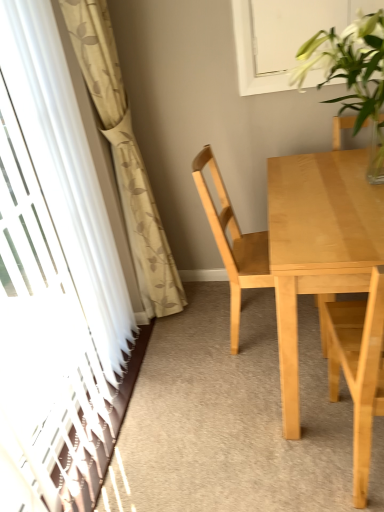
Question: From a real-world perspective, is light wood chair at right, which appears as the 2th chair when viewed from the back, beneath transparent plastic screen door at left?

Choices:
 (A) no
 (B) yes

Answer: (B)

Question: Considering the relative positions of light wood chair at right, arranged as the first chair when viewed from the front, and transparent plastic screen door at left in the image provided, is light wood chair at right, arranged as the first chair when viewed from the front, in front of transparent plastic screen door at left?

Choices:
 (A) yes
 (B) no

Answer: (B)

Question: From a real-world perspective, is light wood chair at right, which appears as the 2th chair when viewed from the back, positioned over transparent plastic screen door at left based on gravity?

Choices:
 (A) yes
 (B) no

Answer: (B)

Question: Is light wood chair at right, arranged as the first chair when viewed from the front, at the left side of transparent plastic screen door at left?

Choices:
 (A) yes
 (B) no

Answer: (B)

Question: Can you confirm if light wood chair at right, which appears as the 2th chair when viewed from the back, is smaller than transparent plastic screen door at left?

Choices:
 (A) no
 (B) yes

Answer: (B)

Question: Considering their positions, is light wood table at center located in front of or behind transparent plastic screen door at left?

Choices:
 (A) front
 (B) behind

Answer: (B)

Question: Considering the positions of point (289, 262) and point (114, 330), is point (289, 262) closer or farther from the camera than point (114, 330)?

Choices:
 (A) farther
 (B) closer

Answer: (B)

Question: Considering the positions of light wood table at center and transparent plastic screen door at left in the image, is light wood table at center bigger or smaller than transparent plastic screen door at left?

Choices:
 (A) small
 (B) big

Answer: (B)

Question: From the image's perspective, is light wood table at center located above or below transparent plastic screen door at left?

Choices:
 (A) below
 (B) above

Answer: (A)

Question: From the image's perspective, is beige floral curtain at left above or below transparent plastic screen door at left?

Choices:
 (A) above
 (B) below

Answer: (A)

Question: From a real-world perspective, is beige floral curtain at left positioned above or below transparent plastic screen door at left?

Choices:
 (A) below
 (B) above

Answer: (A)

Question: In terms of size, does beige floral curtain at left appear bigger or smaller than transparent plastic screen door at left?

Choices:
 (A) small
 (B) big

Answer: (A)

Question: Considering the positions of point (158, 306) and point (132, 326), is point (158, 306) closer or farther from the camera than point (132, 326)?

Choices:
 (A) closer
 (B) farther

Answer: (B)

Question: Is beige floral curtain at left bigger or smaller than light wood chair at center, which is the second chair from front to back?

Choices:
 (A) big
 (B) small

Answer: (B)

Question: In terms of width, does beige floral curtain at left look wider or thinner when compared to light wood chair at center, which is the second chair from front to back?

Choices:
 (A) wide
 (B) thin

Answer: (B)